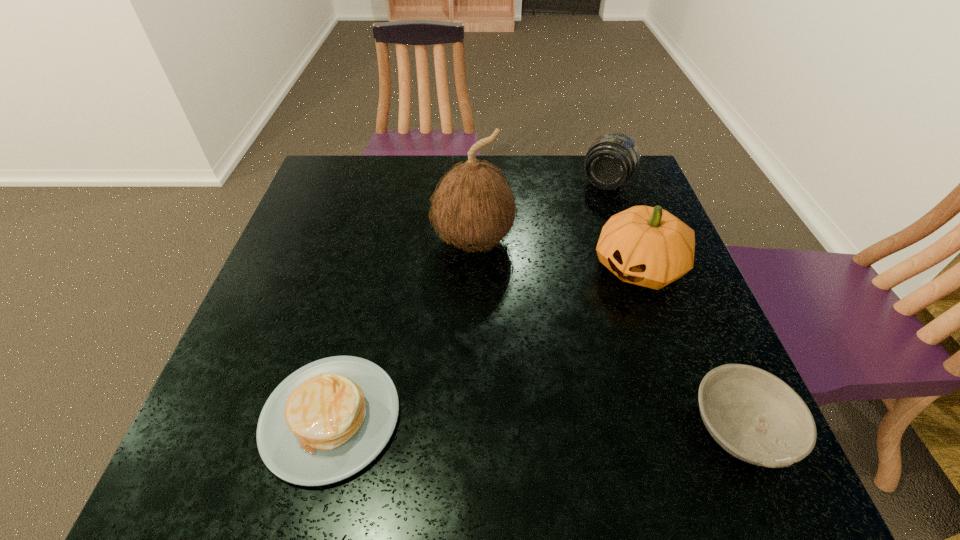
In the image, there is a desktop. Identify the location of vacant space at the left edge. (276, 303).

The image size is (960, 540). In order to click on free region at the far left corner in this screenshot , I will do `click(366, 176)`.

The width and height of the screenshot is (960, 540). In the image, there is a desktop. Find the location of `vacant space at the near left corner`. vacant space at the near left corner is located at coordinates (254, 416).

This screenshot has width=960, height=540. Identify the location of vacant region between the coconut and the leftmost object. (402, 329).

Identify the location of vacant area that lies between the leftmost object and the coconut. (402, 329).

Where is `free spot between the pancake and the third shortest object`? This screenshot has height=540, width=960. free spot between the pancake and the third shortest object is located at coordinates (468, 300).

What are the coordinates of `free space between the fourth object from right to left and the telephoto lens` in the screenshot? It's located at (540, 212).

Identify the location of empty space between the second tallest object and the leftmost object. Image resolution: width=960 pixels, height=540 pixels. (485, 342).

Locate an element on the screen. The width and height of the screenshot is (960, 540). vacant area that lies between the second object from left to right and the third tallest object is located at coordinates (540, 212).

Where is `empty space between the farthest object and the second object from left to right`? This screenshot has width=960, height=540. empty space between the farthest object and the second object from left to right is located at coordinates (540, 212).